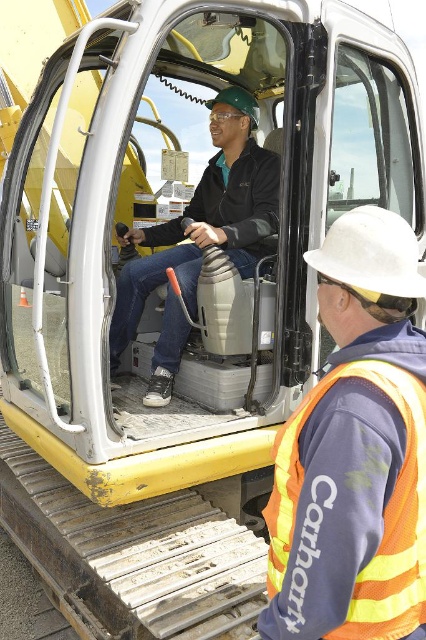
Is matte black jacket at center taller than orange reflective safety vest at lower right?

Correct, matte black jacket at center is much taller as orange reflective safety vest at lower right.

Is point (250, 227) more distant than point (405, 403)?

Yes, point (250, 227) is farther from viewer.

Is point (138, 292) behind point (419, 474)?

Yes, it is behind point (419, 474).

Locate an element on the screen. matte black jacket at center is located at coordinates (206, 218).